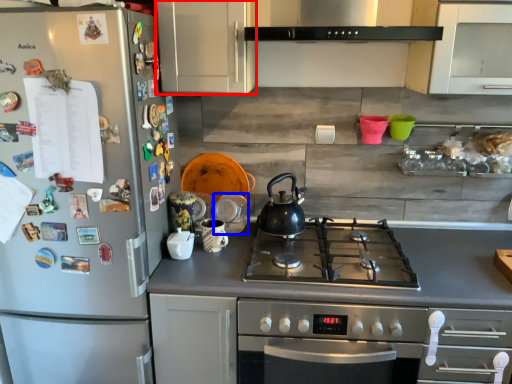
Question: Which object appears closest to the camera in this image, cabinetry (highlighted by a red box) or appliance (highlighted by a blue box)?

Choices:
 (A) cabinetry
 (B) appliance

Answer: (A)